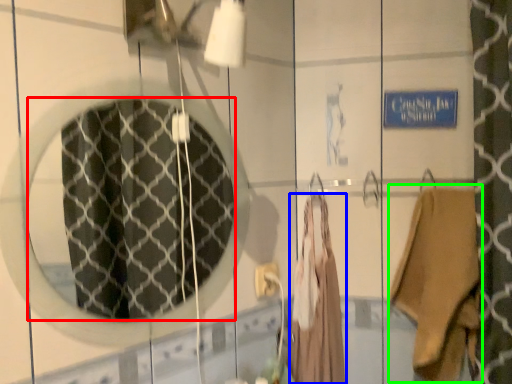
Question: Which object is positioned closest to mirror (highlighted by a red box)? Select from clothing (highlighted by a blue box) and clothing (highlighted by a green box).

Choices:
 (A) clothing
 (B) clothing

Answer: (A)